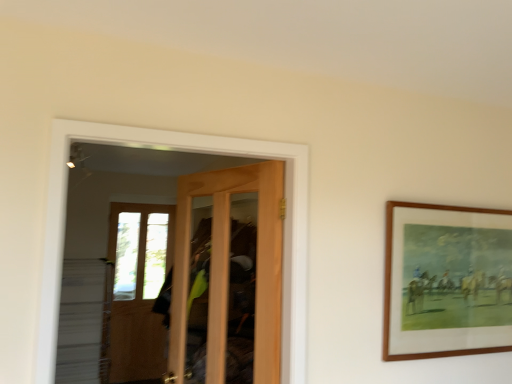
Question: Considering the relative sizes of light brown wooden door at center and wooden framed painting at upper right in the image provided, is light brown wooden door at center taller than wooden framed painting at upper right?

Choices:
 (A) no
 (B) yes

Answer: (B)

Question: Would you say light brown wooden door at center is outside wooden framed painting at upper right?

Choices:
 (A) yes
 (B) no

Answer: (A)

Question: Does light brown wooden door at center have a smaller size compared to wooden framed painting at upper right?

Choices:
 (A) no
 (B) yes

Answer: (A)

Question: Is the surface of light brown wooden door at center in direct contact with wooden framed painting at upper right?

Choices:
 (A) no
 (B) yes

Answer: (A)

Question: Considering the relative positions of light brown wooden door at center and wooden framed painting at upper right in the image provided, is light brown wooden door at center to the right of wooden framed painting at upper right from the viewer's perspective?

Choices:
 (A) no
 (B) yes

Answer: (A)

Question: Could you tell me if light brown wooden door at center is facing wooden framed painting at upper right?

Choices:
 (A) yes
 (B) no

Answer: (B)

Question: Is wooden framed painting at upper right outside of light brown wooden door at center?

Choices:
 (A) no
 (B) yes

Answer: (B)

Question: Does wooden framed painting at upper right come behind light brown wooden door at center?

Choices:
 (A) yes
 (B) no

Answer: (A)

Question: Is wooden framed painting at upper right next to light brown wooden door at center?

Choices:
 (A) no
 (B) yes

Answer: (A)

Question: Is wooden framed painting at upper right facing towards light brown wooden door at center?

Choices:
 (A) yes
 (B) no

Answer: (B)

Question: Would you consider wooden framed painting at upper right to be distant from light brown wooden door at center?

Choices:
 (A) yes
 (B) no

Answer: (B)

Question: Considering the relative sizes of wooden framed painting at upper right and light brown wooden door at center in the image provided, is wooden framed painting at upper right thinner than light brown wooden door at center?

Choices:
 (A) no
 (B) yes

Answer: (B)

Question: From a real-world perspective, is light brown wooden door at center physically located above or below wooden framed painting at upper right?

Choices:
 (A) below
 (B) above

Answer: (A)